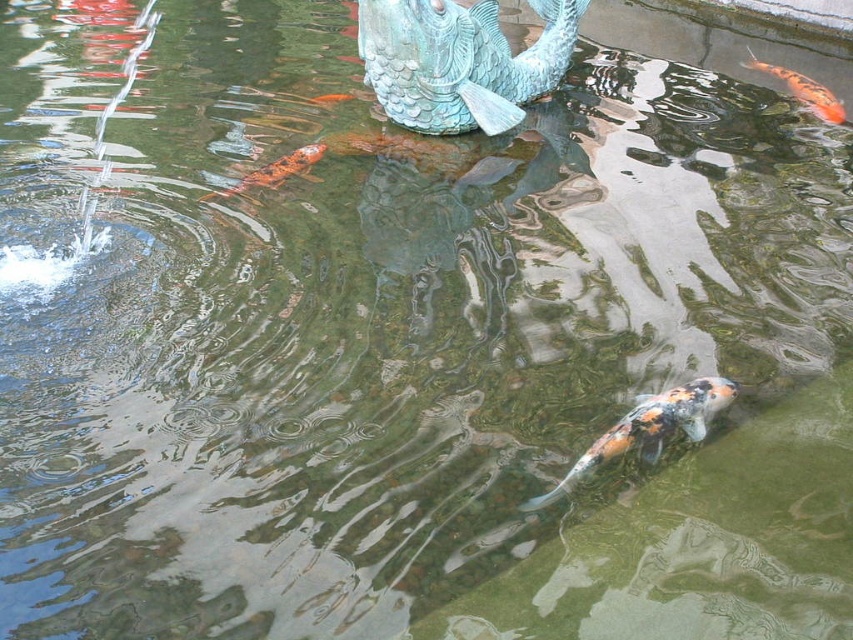
Question: Which point is closer to the camera?

Choices:
 (A) (238, 188)
 (B) (352, 96)
 (C) (634, 428)

Answer: (C)

Question: Which of the following is the farthest from the observer?

Choices:
 (A) (270, 172)
 (B) (544, 502)

Answer: (A)

Question: Can you confirm if orange shiny fish at upper right is positioned below shiny orange fish at center?

Choices:
 (A) no
 (B) yes

Answer: (A)

Question: Estimate the real-world distances between objects in this image. Which object is farther from the orange shiny fish at center?

Choices:
 (A) speckled orange and white fish at center
 (B) orange shiny fish at upper right
 (C) shiny orange fish at center

Answer: (B)

Question: Is orange shiny fish at upper right above shiny orange fish at center?

Choices:
 (A) no
 (B) yes

Answer: (B)

Question: Is orange shiny fish at upper right wider than shiny orange fish at center?

Choices:
 (A) no
 (B) yes

Answer: (B)